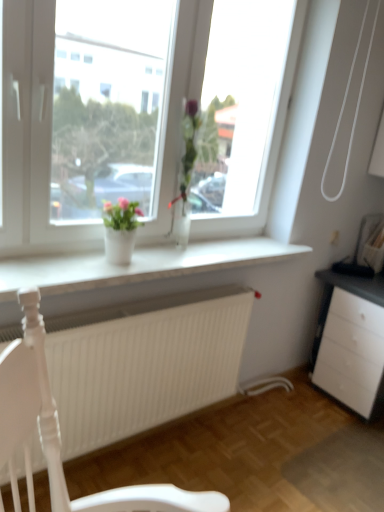
Question: Is white glass vase at center wider than clear glass vase at center, which is the first houseplant from right to left?

Choices:
 (A) no
 (B) yes

Answer: (A)

Question: Could you tell me if white glass vase at center is facing clear glass vase at center, which is the first houseplant from right to left?

Choices:
 (A) no
 (B) yes

Answer: (B)

Question: Is white glass vase at center closer to the viewer compared to clear glass vase at center, which is the 2th houseplant from left to right?

Choices:
 (A) no
 (B) yes

Answer: (B)

Question: Considering the relative sizes of white glass vase at center and clear glass vase at center, which is the first houseplant from right to left, in the image provided, is white glass vase at center bigger than clear glass vase at center, which is the first houseplant from right to left,?

Choices:
 (A) no
 (B) yes

Answer: (B)

Question: Is white glass vase at center at the right side of clear glass vase at center, which is the 2th houseplant from left to right?

Choices:
 (A) yes
 (B) no

Answer: (B)

Question: Considering the positions of white glass vase at center and white glossy vase at center, the 2th houseplant from the right, in the image, is white glass vase at center wider or thinner than white glossy vase at center, the 2th houseplant from the right,?

Choices:
 (A) thin
 (B) wide

Answer: (A)

Question: Based on their sizes in the image, would you say white glass vase at center is bigger or smaller than white glossy vase at center, the 1th houseplant from the left?

Choices:
 (A) big
 (B) small

Answer: (A)

Question: Relative to white glossy vase at center, the 2th houseplant from the right, is white glass vase at center in front or behind?

Choices:
 (A) behind
 (B) front

Answer: (B)

Question: Considering the positions of white glass vase at center and white glossy vase at center, the 2th houseplant from the right, in the image, is white glass vase at center taller or shorter than white glossy vase at center, the 2th houseplant from the right,?

Choices:
 (A) short
 (B) tall

Answer: (B)

Question: Which is correct: clear glass vase at center, which is the 2th houseplant from left to right, is inside white matte radiator at lower center, or outside of it?

Choices:
 (A) outside
 (B) inside

Answer: (A)

Question: From a real-world perspective, relative to white matte radiator at lower center, is clear glass vase at center, which is the 2th houseplant from left to right, vertically above or below?

Choices:
 (A) below
 (B) above

Answer: (B)

Question: Considering the positions of clear glass vase at center, which is the first houseplant from right to left, and white matte radiator at lower center in the image, is clear glass vase at center, which is the first houseplant from right to left, taller or shorter than white matte radiator at lower center?

Choices:
 (A) tall
 (B) short

Answer: (A)

Question: Relative to white matte radiator at lower center, is clear glass vase at center, which is the first houseplant from right to left, in front or behind?

Choices:
 (A) front
 (B) behind

Answer: (B)

Question: Is white smooth window sill at center inside or outside of white glossy vase at center, the 2th houseplant from the right?

Choices:
 (A) inside
 (B) outside

Answer: (B)

Question: Considering the relative positions of white smooth window sill at center and white glossy vase at center, the 1th houseplant from the left, in the image provided, is white smooth window sill at center to the left or to the right of white glossy vase at center, the 1th houseplant from the left,?

Choices:
 (A) right
 (B) left

Answer: (A)